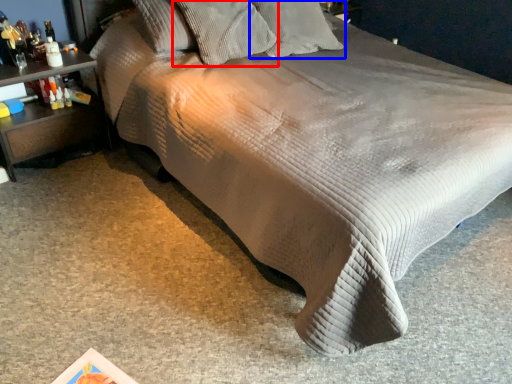
Question: Which of the following is the closest to the observer, pillow (highlighted by a red box) or pillow (highlighted by a blue box)?

Choices:
 (A) pillow
 (B) pillow

Answer: (A)